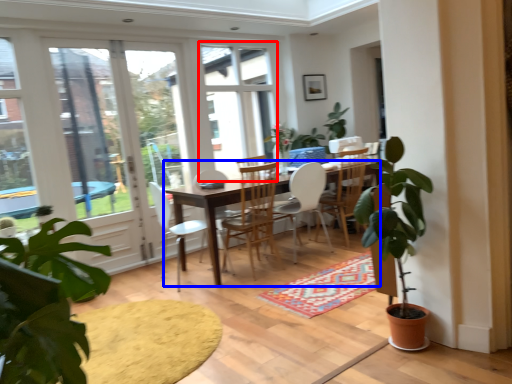
Question: Which object appears farthest to the camera in this image, window (highlighted by a red box) or desk (highlighted by a blue box)?

Choices:
 (A) window
 (B) desk

Answer: (A)